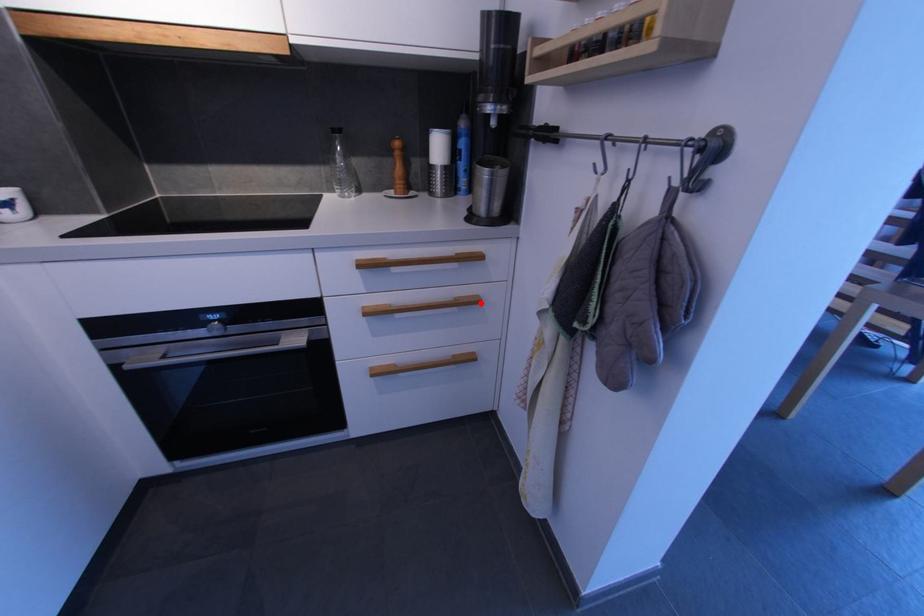
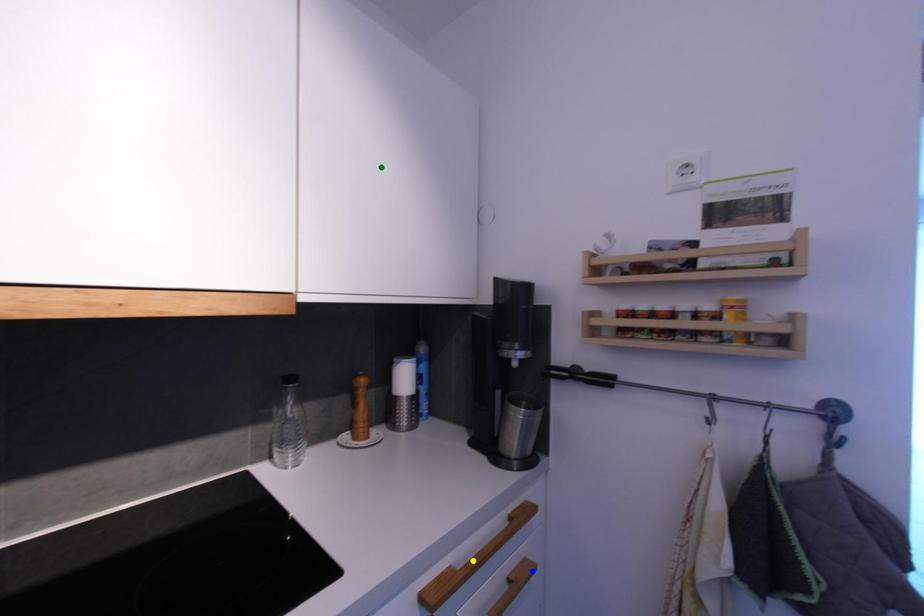
Question: I am providing you with two images of the same scene from different viewpoints. A red point is marked on the first image. You are given multiple points on the second image. In image 2, which mark is for the same physical point as the one in image 1?

Choices:
 (A) green point
 (B) yellow point
 (C) blue point

Answer: (C)